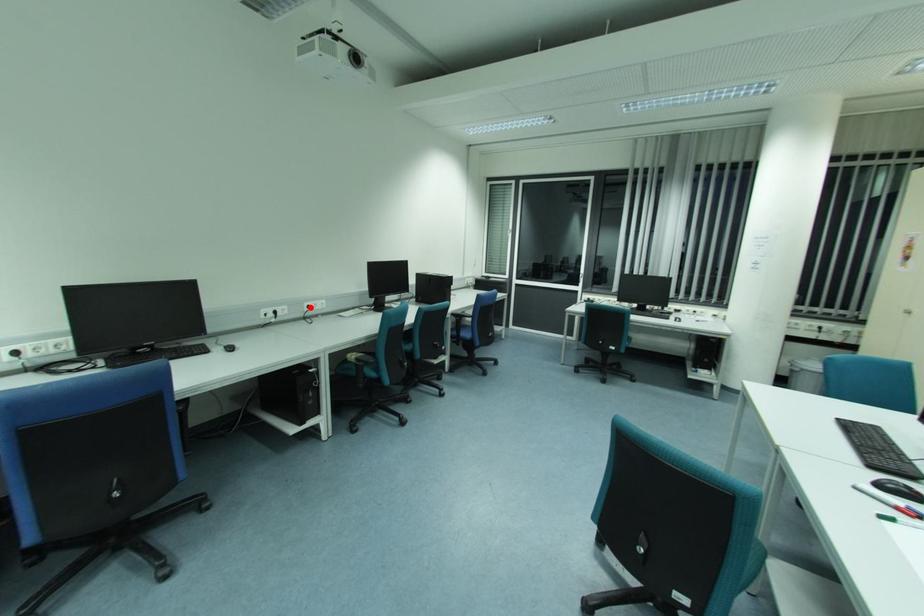
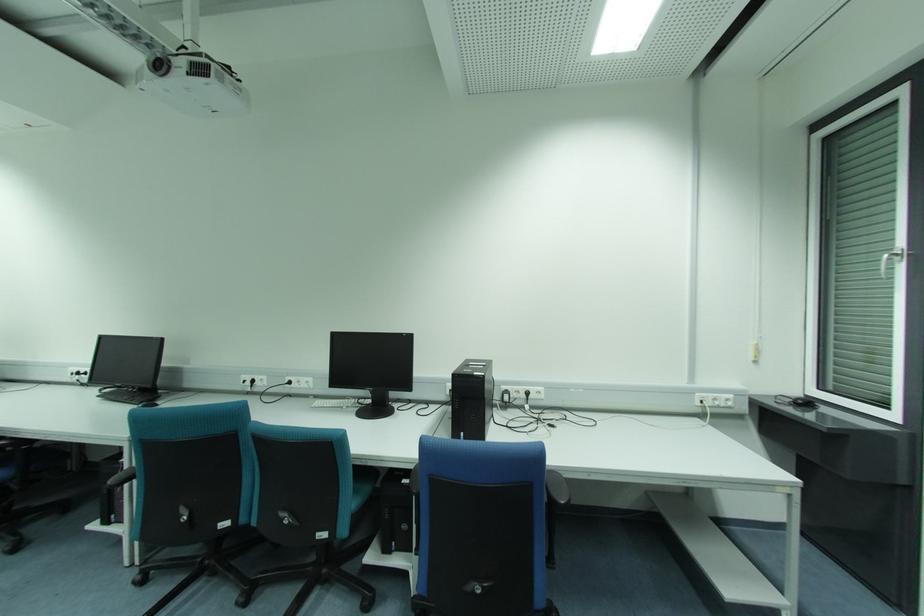
Question: I am providing you with two images of the same scene from different viewpoints. Image1 has a red point marked. In image2, the corresponding 3D location appears at what relative position? Reply with the corresponding letter.

Choices:
 (A) Closer
 (B) Farther

Answer: (A)